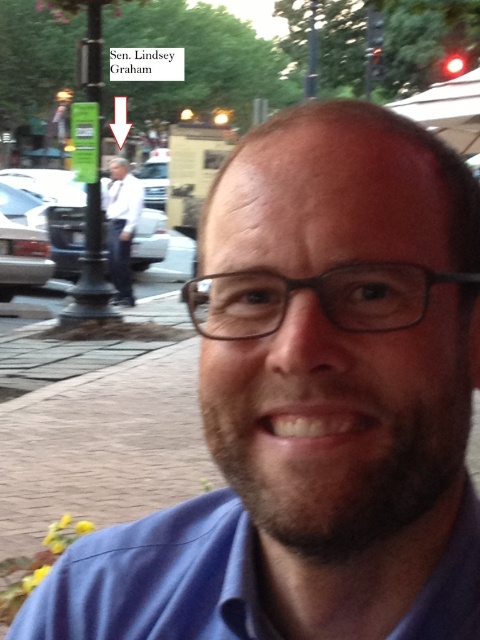
Measure the distance between point (222, 621) and camera.

Point (222, 621) and camera are 16.33 inches apart.

This screenshot has height=640, width=480. What do you see at coordinates (156, 579) in the screenshot?
I see `blue cotton dress shirt at center` at bounding box center [156, 579].

Who is more forward, (85,632) or (137,205)?

Point (85,632)

Find the location of `blue cotton dress shirt at center`. blue cotton dress shirt at center is located at coordinates (156, 579).